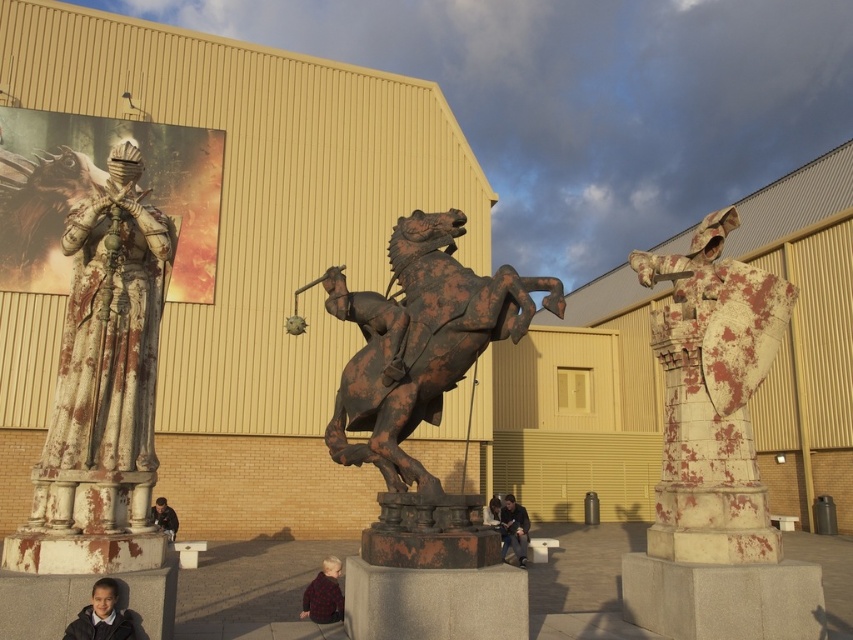
Does rusty stone knight at right appear over dark blue school uniform at lower left?

Yes.

Between point (665, 460) and point (79, 612), which one is positioned in front?

Point (79, 612) is more forward.

This screenshot has height=640, width=853. I want to click on rusty stone knight at right, so click(712, 397).

Is point (126, 284) less distant than point (524, 516)?

That is True.

Is point (115, 477) closer to camera compared to point (503, 536)?

Yes, point (115, 477) is closer to viewer.

Find the location of a particular element. The height and width of the screenshot is (640, 853). rusty metal knight at left is located at coordinates (106, 358).

Between rusty metal knight at left and plaid wool sweater at lower center, which one appears on the left side from the viewer's perspective?

From the viewer's perspective, rusty metal knight at left appears more on the left side.

Does rusty metal knight at left appear under plaid wool sweater at lower center?

Actually, rusty metal knight at left is above plaid wool sweater at lower center.

Does point (68, 252) come in front of point (334, 570)?

That is True.

In order to click on rusty metal knight at left in this screenshot , I will do `click(106, 358)`.